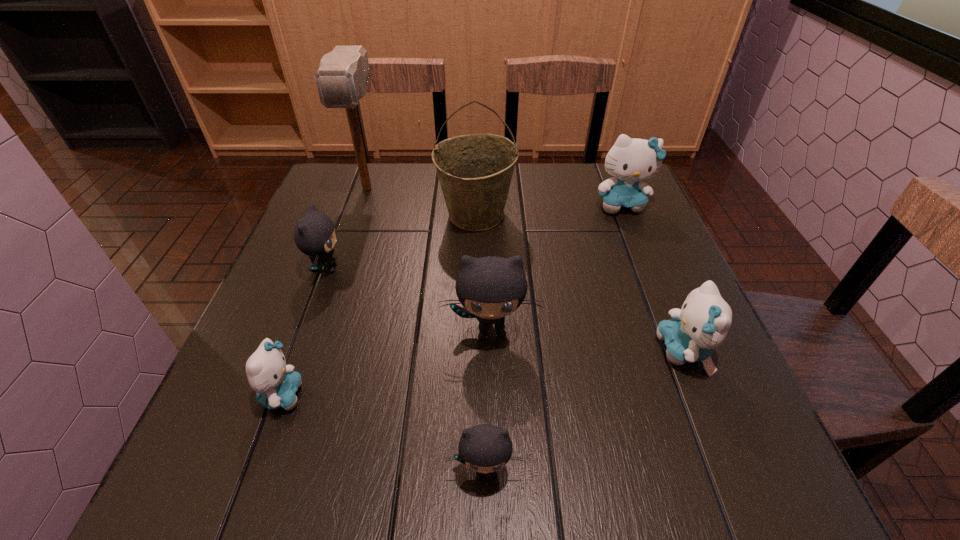
Image resolution: width=960 pixels, height=540 pixels. In order to click on vacant point at the right edge in this screenshot , I will do `click(596, 230)`.

In the image, there is a desktop. In order to click on free region at the far left corner in this screenshot , I will do click(357, 194).

Where is `vacant space at the far right corner of the desktop`? This screenshot has height=540, width=960. vacant space at the far right corner of the desktop is located at coordinates (599, 201).

This screenshot has width=960, height=540. Identify the location of vacant space at the near right corner. (742, 478).

This screenshot has width=960, height=540. In order to click on vacant point located between the second nearest gray kitten and the farthest kitten in this screenshot , I will do `click(556, 267)`.

What are the coordinates of `free space between the smallest blue kitten and the farthest gray kitten` in the screenshot? It's located at (304, 332).

Find the location of a particular element. This screenshot has width=960, height=540. vacant space that's between the mallet and the leftmost blue kitten is located at coordinates (324, 292).

This screenshot has height=540, width=960. I want to click on free space between the nearest gray kitten and the leftmost blue kitten, so click(x=384, y=432).

Find the location of a particular element. vacant area between the farthest kitten and the leftmost blue kitten is located at coordinates (452, 300).

Locate an element on the screen. The image size is (960, 540). free space between the farthest gray kitten and the smallest gray kitten is located at coordinates (406, 369).